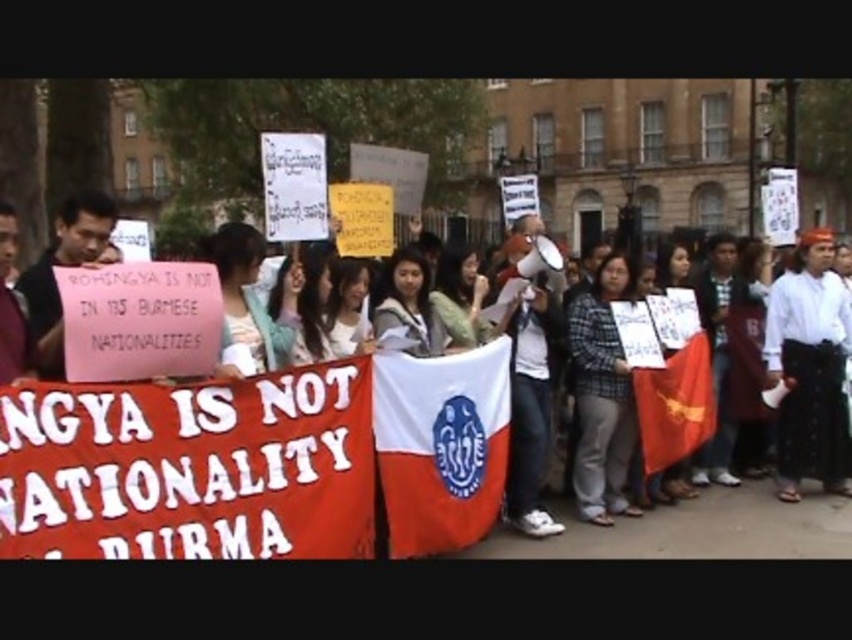
Does red fabric banner at center have a greater width compared to plaid shirt at center?

Indeed, red fabric banner at center has a greater width compared to plaid shirt at center.

The image size is (852, 640). Describe the element at coordinates (191, 467) in the screenshot. I see `red fabric banner at center` at that location.

Identify the location of red fabric banner at center. (191, 467).

Does white fabric flag at center appear over plaid shirt at center?

No, white fabric flag at center is not above plaid shirt at center.

Which is in front, point (427, 392) or point (609, 396)?

Point (427, 392)

Find the location of a particular element. The height and width of the screenshot is (640, 852). white fabric flag at center is located at coordinates (441, 445).

Between point (199, 490) and point (826, 394), which one is positioned in front?

Point (199, 490) is in front.

Can you confirm if white fabric banner at center is positioned above white cotton shirt at center?

Incorrect, white fabric banner at center is not positioned above white cotton shirt at center.

Is point (384, 492) behind point (839, 280)?

No, (384, 492) is closer to viewer.

Locate an element on the screen. The height and width of the screenshot is (640, 852). white fabric banner at center is located at coordinates (257, 461).